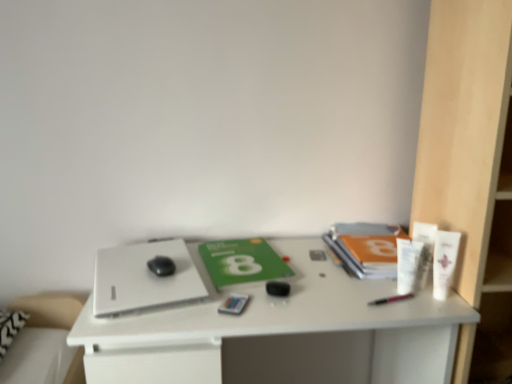
Where is `vacant space that is in between green matte paperback book at center, the second paperback book in the right-to-left sequence, and white plastic tube at right, which is the 2th toiletry in right-to-left order`? vacant space that is in between green matte paperback book at center, the second paperback book in the right-to-left sequence, and white plastic tube at right, which is the 2th toiletry in right-to-left order is located at coordinates (322, 276).